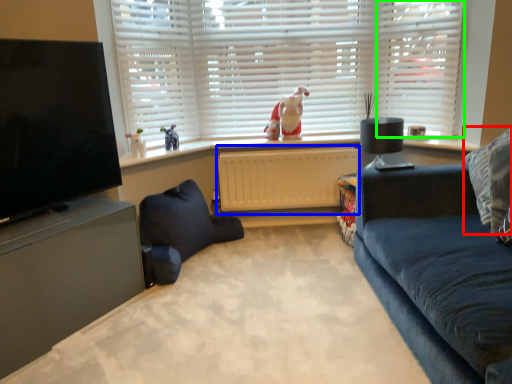
Question: Estimate the real-world distances between objects in this image. Which object is closer to pillow (highlighted by a red box), radiator (highlighted by a blue box) or window frame (highlighted by a green box)?

Choices:
 (A) radiator
 (B) window frame

Answer: (B)